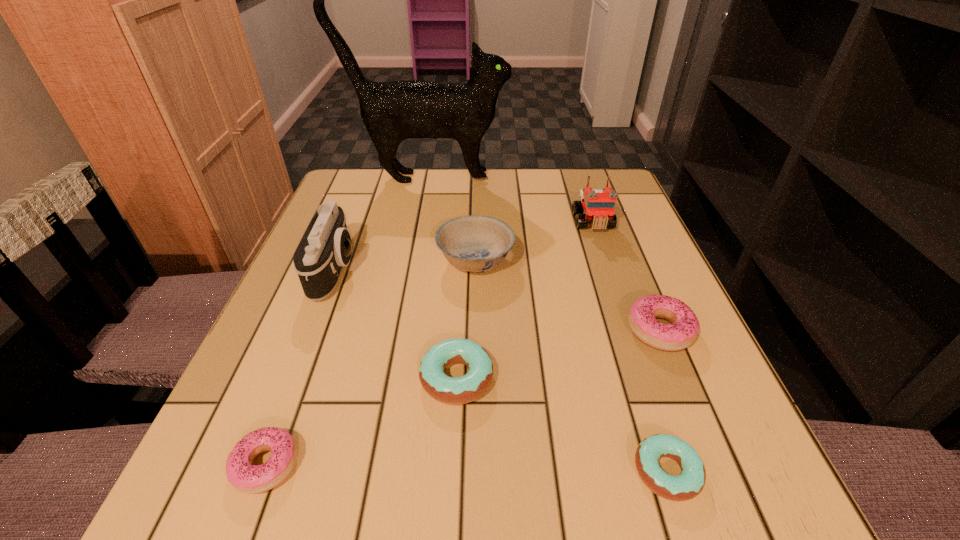
Find the location of a particular element. the left blue doughnut is located at coordinates (449, 390).

The height and width of the screenshot is (540, 960). In order to click on the leftmost doughnut in this screenshot , I will do `click(252, 479)`.

At what (x,y) coordinates should I click in order to perform the action: click on the nearer pink doughnut. Please return your answer as a coordinate pair (x, y). The width and height of the screenshot is (960, 540). Looking at the image, I should click on (252, 479).

Locate an element on the screen. Image resolution: width=960 pixels, height=540 pixels. the nearer blue doughnut is located at coordinates (690, 482).

The width and height of the screenshot is (960, 540). Identify the location of the right blue doughnut. (690, 482).

This screenshot has height=540, width=960. In order to click on vacant space positioned on the face of the tallest object in this screenshot , I will do `click(572, 178)`.

I want to click on vacant space situated 0.060m on the front lens of the camera, so click(x=385, y=270).

Locate an element on the screen. Image resolution: width=960 pixels, height=540 pixels. vacant space situated 0.270m on the front-facing side of the Lego is located at coordinates (627, 321).

Identify the location of blank space located on the back of the fourth tallest object. (476, 212).

You are a GUI agent. You are given a task and a screenshot of the screen. Output one action in this format:
    pyautogui.click(x=<x>, y=<y>)
    Task: Click on the vacant space located 0.310m on the back of the bigger pink doughnut
    
    Given the screenshot: What is the action you would take?
    pyautogui.click(x=613, y=217)